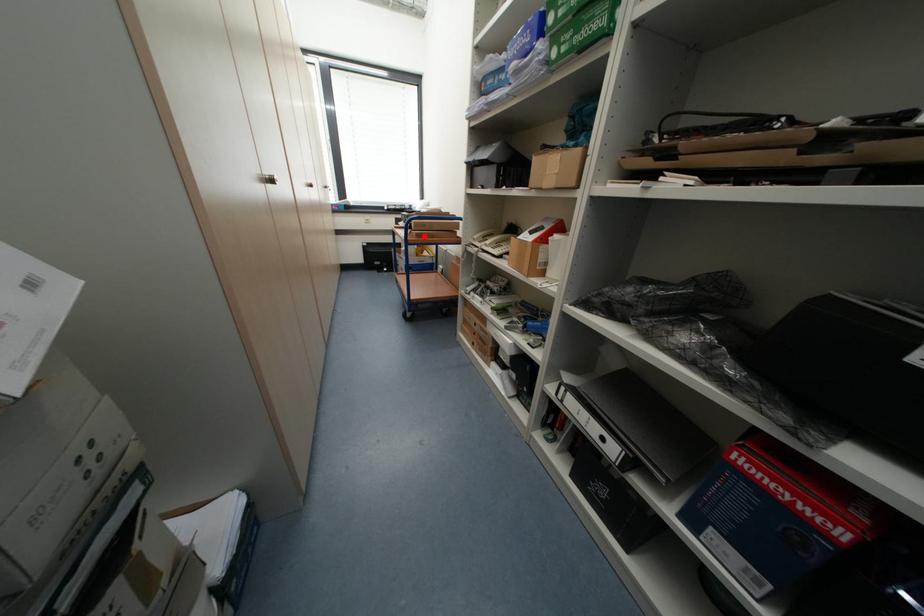
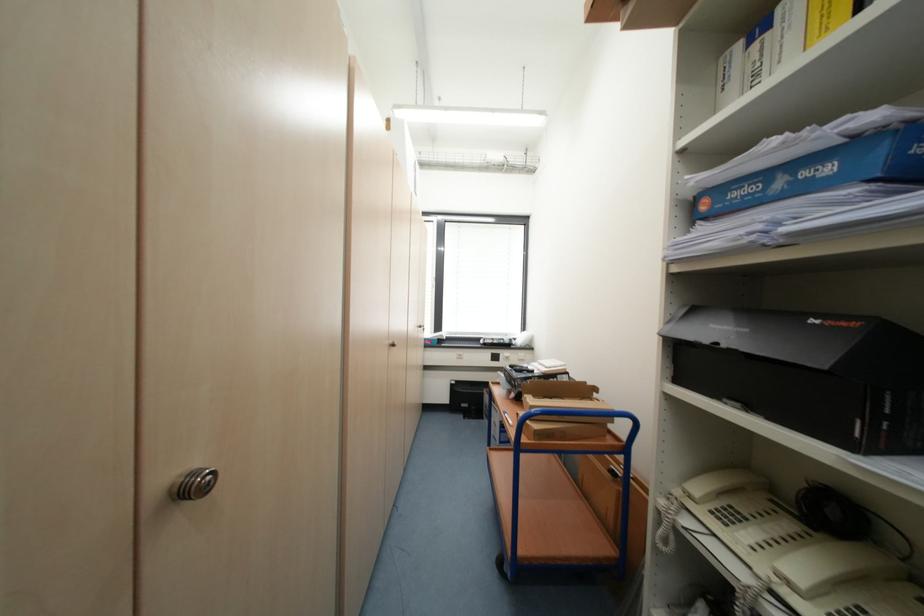
Find the pixel in the second image that matches the highlighted location in the first image.

(544, 436)